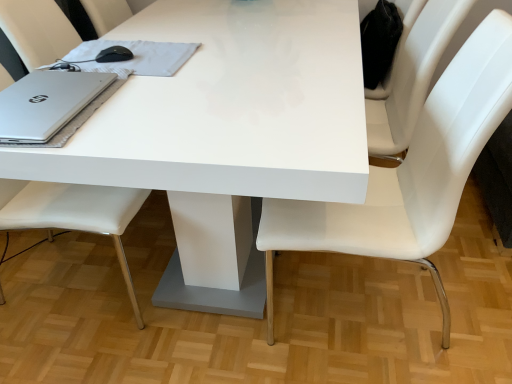
This screenshot has width=512, height=384. What are the coordinates of `vacant point to the right of white leather chair at center, positioned as the first chair in right-to-left order` in the screenshot? It's located at (472, 291).